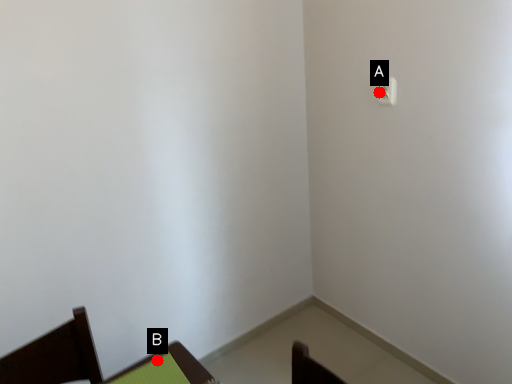
Question: Two points are circled on the image, labeled by A and B beside each circle. Which point is farther from the camera taking this photo?

Choices:
 (A) A is further
 (B) B is further

Answer: (A)